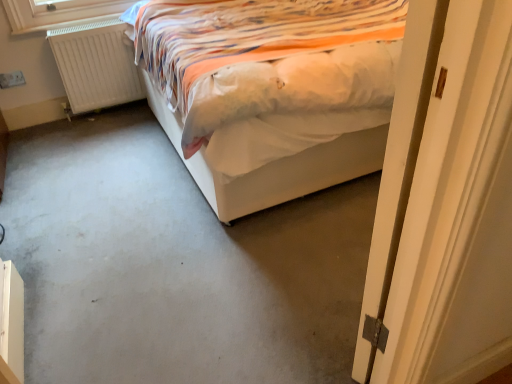
Question: From the image's perspective, is white wooden door at right located above or below white matte radiator at left?

Choices:
 (A) above
 (B) below

Answer: (B)

Question: In terms of size, does white wooden door at right appear bigger or smaller than white matte radiator at left?

Choices:
 (A) big
 (B) small

Answer: (A)

Question: Which is nearer to the white matte radiator at left?

Choices:
 (A) white fabric bed at center
 (B) gray carpet at center
 (C) white wooden door at right

Answer: (A)

Question: Estimate the real-world distances between objects in this image. Which object is farther from the white fabric bed at center?

Choices:
 (A) white wooden door at right
 (B) gray carpet at center
 (C) white matte radiator at left

Answer: (A)